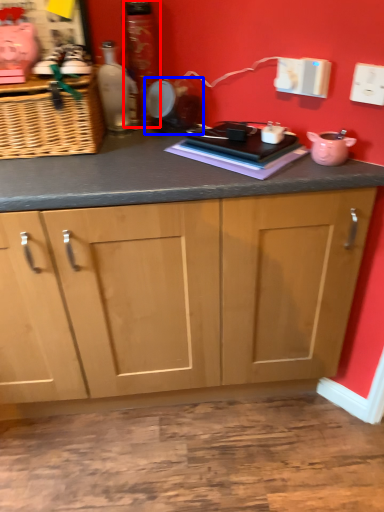
Question: Which object is closer to the camera taking this photo, bottle (highlighted by a red box) or appliance (highlighted by a blue box)?

Choices:
 (A) bottle
 (B) appliance

Answer: (B)